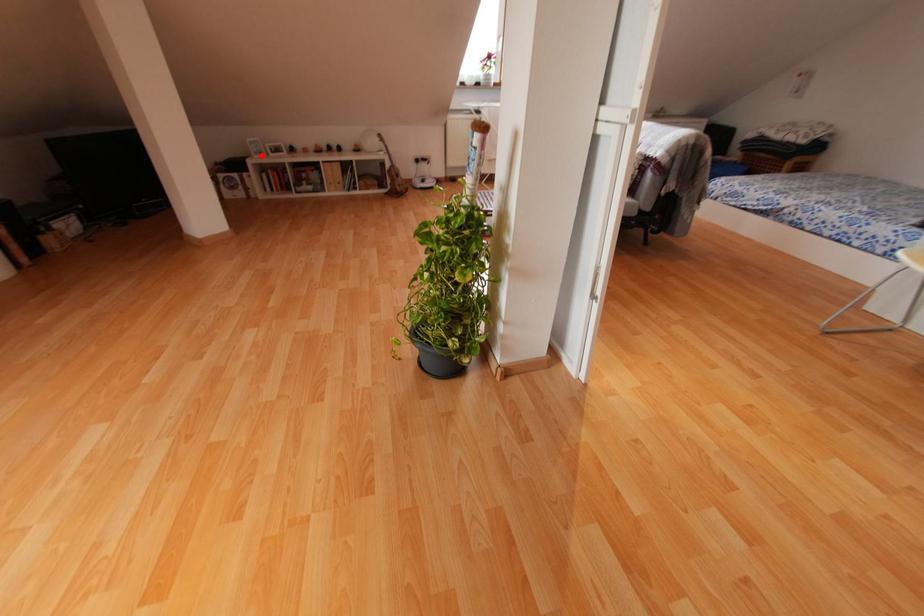
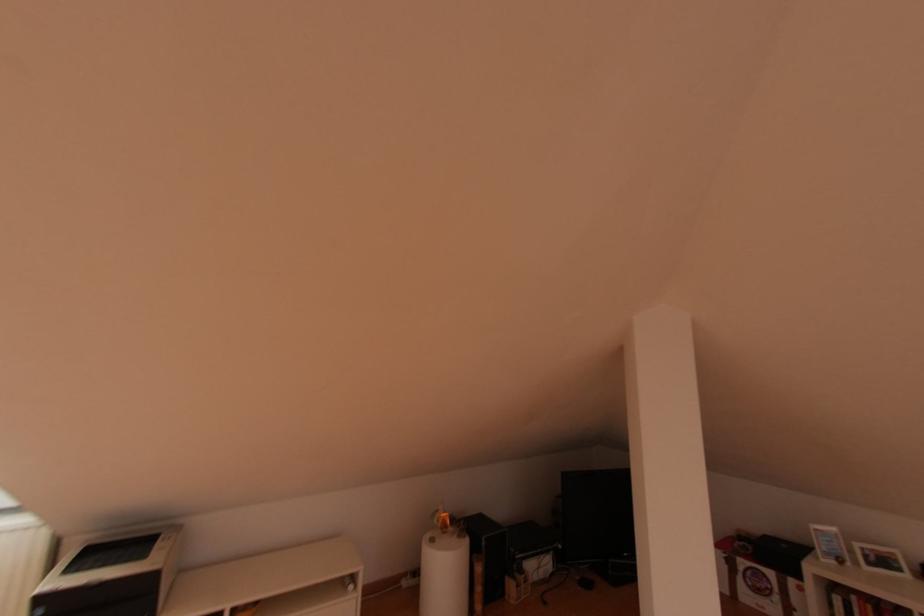
Find the pixel in the second image that matches the highlighted location in the first image.

(840, 562)